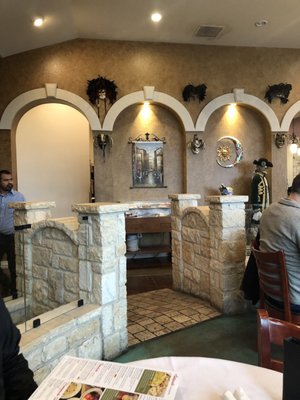
The width and height of the screenshot is (300, 400). In order to click on tablecloth in this screenshot , I will do `click(200, 384)`.